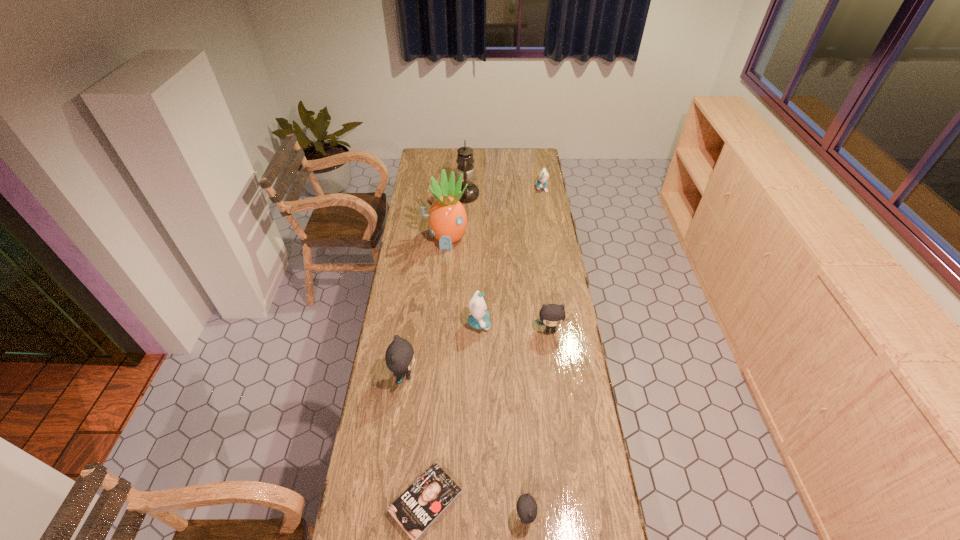
Image resolution: width=960 pixels, height=540 pixels. In order to click on oil lamp in this screenshot , I will do `click(465, 160)`.

The image size is (960, 540). I want to click on the third farthest object, so click(x=447, y=217).

In order to click on pineapple in this screenshot , I will do `click(447, 217)`.

The image size is (960, 540). Identify the location of the sixth farthest object. (399, 357).

Locate an element on the screen. The image size is (960, 540). the second nearest gray kitten is located at coordinates (399, 357).

This screenshot has height=540, width=960. I want to click on the second kitten from left to right, so click(x=479, y=318).

This screenshot has height=540, width=960. Identify the location of the bigger blue kitten. (479, 318).

What are the coordinates of `the rightmost gray kitten` in the screenshot? It's located at (551, 315).

Locate an element on the screen. Image resolution: width=960 pixels, height=540 pixels. the farthest gray kitten is located at coordinates (551, 315).

Locate an element on the screen. The height and width of the screenshot is (540, 960). the right blue kitten is located at coordinates (543, 176).